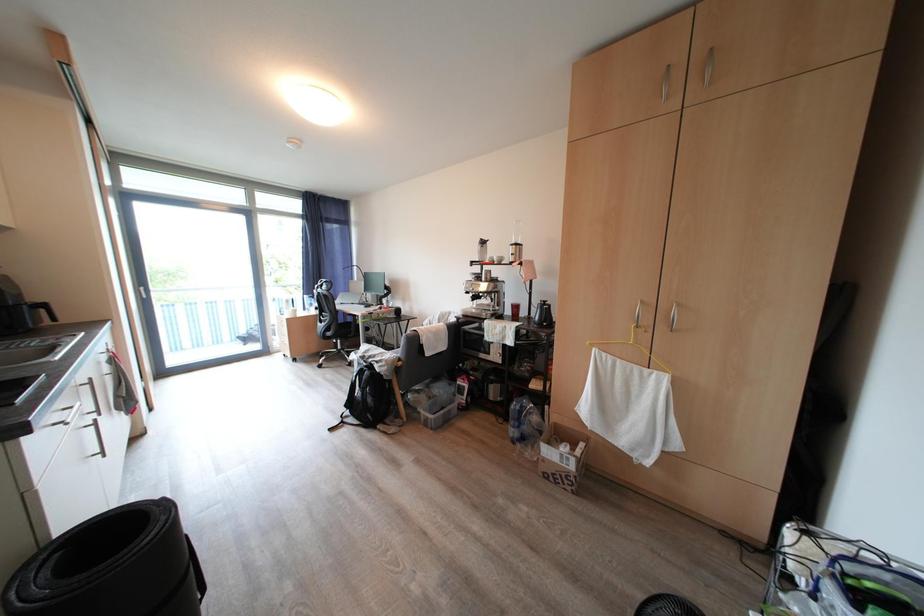
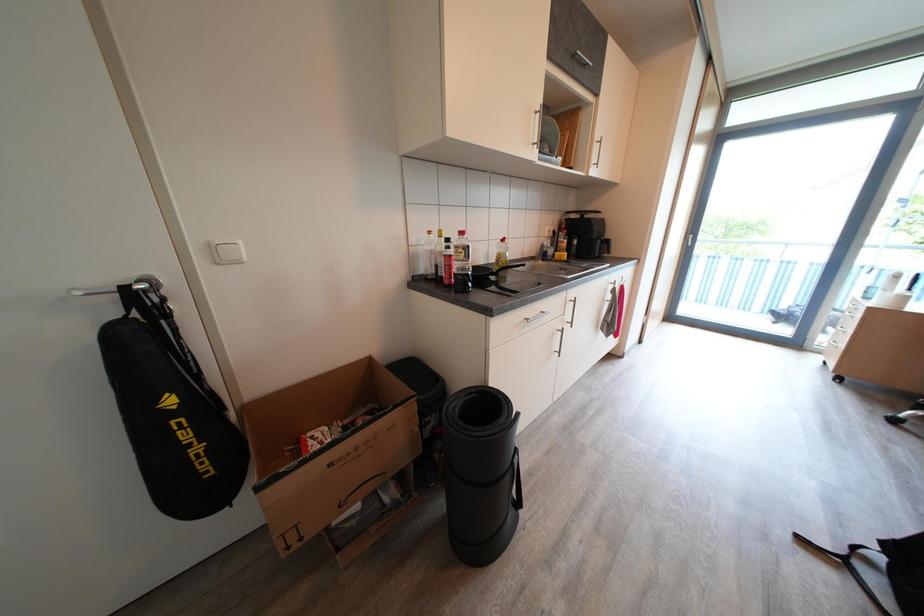
The images are taken continuously from a first-person perspective. In which direction is your viewpoint rotating?

The rotation direction of the camera is left-down.